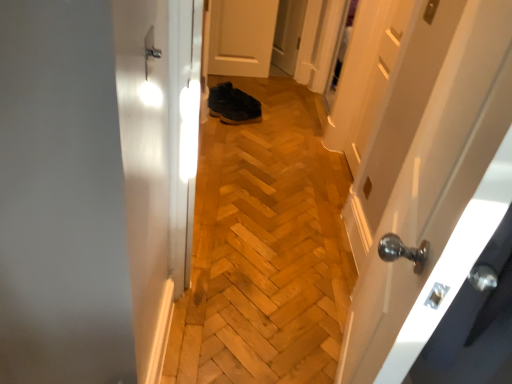
Where is `vacant space underneath white matte door at center, placed as the 1th door when sorted from top to bottom (from a real-world perspective)`? vacant space underneath white matte door at center, placed as the 1th door when sorted from top to bottom (from a real-world perspective) is located at coordinates (236, 73).